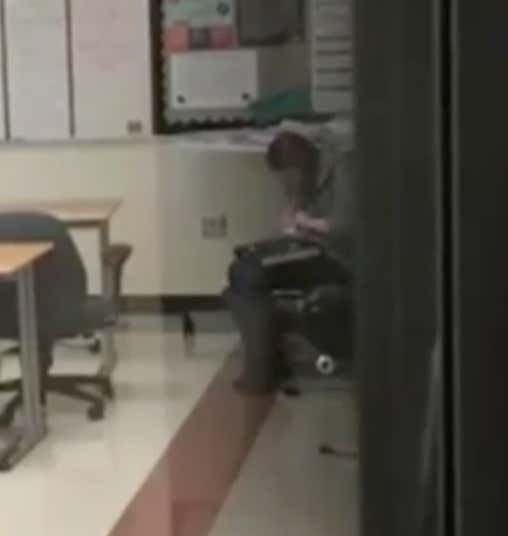
Where is `doorframe`? The image size is (508, 536). doorframe is located at coordinates (414, 254).